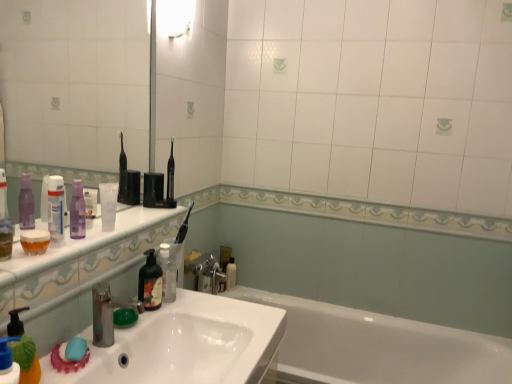
Question: From the image's perspective, is blue matte pump bottle at lower left located above or below white glossy tube at upper left, placed as the first toiletry when sorted from left to right?

Choices:
 (A) above
 (B) below

Answer: (B)

Question: Considering the positions of blue matte pump bottle at lower left and white glossy tube at upper left, marked as the 3th toiletry in a bottom-to-top arrangement, in the image, is blue matte pump bottle at lower left wider or thinner than white glossy tube at upper left, marked as the 3th toiletry in a bottom-to-top arrangement,?

Choices:
 (A) thin
 (B) wide

Answer: (B)

Question: Estimate the real-world distances between objects in this image. Which object is farther from the translucent plastic bottle at sink?

Choices:
 (A) transparent plastic mirror at upper left
 (B) blue matte pump bottle at lower left
 (C) white matte tube at center, arranged as the second mouthwash when viewed from the right
 (D) white glossy sink at lower left
 (E) white glossy bathtub at lower right

Answer: (A)

Question: Which object is the closest to the translucent plastic bottle at sink?

Choices:
 (A) white glossy sink at lower left
 (B) white glossy bottle at lower center, the first toiletry positioned from the bottom
 (C) white glossy bathtub at lower right
 (D) translucent floral-patterned mouthwash at sink left, arranged as the first mouthwash when viewed from the right
 (E) black plastic toothbrush at upper center

Answer: (D)